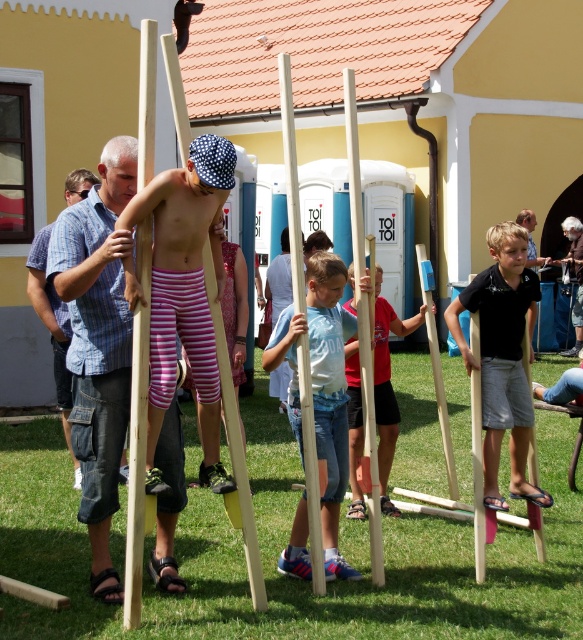
You are a photographer at the event and want to capture a photo of the blue plaid shirt at center and smooth blue shorts at center. Since the camera can only focus on one subject at a time, which subject should you choose to ensure the other is still visible in the background?

The blue plaid shirt at center is located above smooth blue shorts at center, so if you focus on the blue plaid shirt at center, the smooth blue shorts at center will still be visible in the background.

You are a photographer at the event and want to capture a photo of both the black matte shirt at right and the smooth blue shorts at center. Which object should you focus on first to ensure both are in the frame?

The black matte shirt at right is positioned over smooth blue shorts at center, so you should focus on the smooth blue shorts at center first to ensure both are in the frame.

You are organizing a stilt walking competition and need to ensure participants have enough space between them. The black matte shirt at right and the blue plaid shirt at left are standing side by side. Which participant requires more horizontal space due to their clothing?

The black matte shirt at right requires more horizontal space because its width surpasses that of the blue plaid shirt at left.